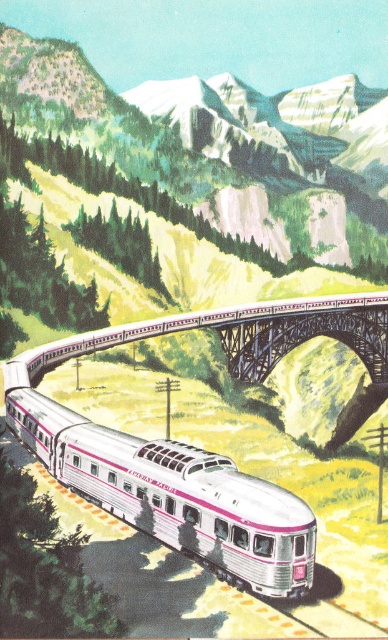
Is silver polished metal train at center below metallic gray bridge at center?

Correct, silver polished metal train at center is located below metallic gray bridge at center.

Is silver polished metal train at center positioned before metallic gray bridge at center?

That is True.

Locate an element on the screen. silver polished metal train at center is located at coordinates (176, 493).

Identify the location of silver polished metal train at center. (176, 493).